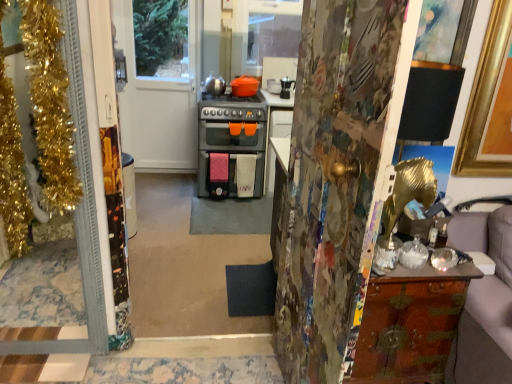
Question: Is painted wood door at center, marked as the 3th door in a left-to-right arrangement, positioned far away from wooden cabinet at right?

Choices:
 (A) no
 (B) yes

Answer: (A)

Question: Is painted wood door at center, marked as the 1th door in a right-to-left arrangement, looking in the opposite direction of wooden cabinet at right?

Choices:
 (A) yes
 (B) no

Answer: (A)

Question: From a real-world perspective, is painted wood door at center, marked as the 3th door in a left-to-right arrangement, physically above wooden cabinet at right?

Choices:
 (A) no
 (B) yes

Answer: (B)

Question: From a real-world perspective, does painted wood door at center, which is the 3th door in back-to-front order, sit lower than wooden cabinet at right?

Choices:
 (A) yes
 (B) no

Answer: (B)

Question: Considering the relative sizes of painted wood door at center, marked as the 3th door in a left-to-right arrangement, and wooden cabinet at right in the image provided, is painted wood door at center, marked as the 3th door in a left-to-right arrangement, taller than wooden cabinet at right?

Choices:
 (A) no
 (B) yes

Answer: (B)

Question: Is gold tinsel at left, positioned as the second door in back-to-front order, taller or shorter than white glossy door at upper center, which is the 2th door in right-to-left order?

Choices:
 (A) short
 (B) tall

Answer: (A)

Question: From a real-world perspective, is gold tinsel at left, the 3th door viewed from the right, above or below white glossy door at upper center, which is the 2th door in left-to-right order?

Choices:
 (A) above
 (B) below

Answer: (B)

Question: Considering their positions, is gold tinsel at left, which is counted as the 2th door, starting from the front, located in front of or behind white glossy door at upper center, which is the 2th door in right-to-left order?

Choices:
 (A) behind
 (B) front

Answer: (B)

Question: Considering the positions of gold tinsel at left, which is counted as the 2th door, starting from the front, and white glossy door at upper center, which is the 2th door in right-to-left order, in the image, is gold tinsel at left, which is counted as the 2th door, starting from the front, bigger or smaller than white glossy door at upper center, which is the 2th door in right-to-left order,?

Choices:
 (A) big
 (B) small

Answer: (A)

Question: Looking at the image, does wooden cabinet at right seem bigger or smaller compared to painted wood door at center, marked as the 1th door in a right-to-left arrangement?

Choices:
 (A) big
 (B) small

Answer: (B)

Question: From a real-world perspective, relative to painted wood door at center, marked as the 1th door in a right-to-left arrangement, is wooden cabinet at right vertically above or below?

Choices:
 (A) below
 (B) above

Answer: (A)

Question: Considering the positions of point (426, 284) and point (348, 155), is point (426, 284) closer or farther from the camera than point (348, 155)?

Choices:
 (A) farther
 (B) closer

Answer: (A)

Question: From the image's perspective, is wooden cabinet at right located above or below painted wood door at center, placed as the first door when sorted from front to back?

Choices:
 (A) below
 (B) above

Answer: (A)

Question: Is point (186, 91) positioned closer to the camera than point (416, 372)?

Choices:
 (A) closer
 (B) farther

Answer: (B)

Question: Is white glossy door at upper center, placed as the 3th door when sorted from front to back, in front of or behind wooden cabinet at right in the image?

Choices:
 (A) front
 (B) behind

Answer: (B)